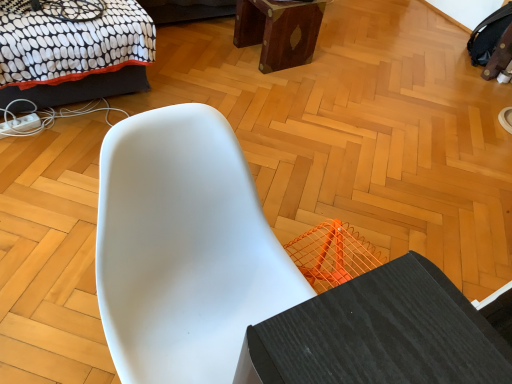
Question: Can you confirm if black dotted fabric bed at upper left is shorter than white matte chair at center?

Choices:
 (A) no
 (B) yes

Answer: (B)

Question: Can you confirm if black dotted fabric bed at upper left is positioned to the right of white matte chair at center?

Choices:
 (A) no
 (B) yes

Answer: (A)

Question: From a real-world perspective, is black dotted fabric bed at upper left below white matte chair at center?

Choices:
 (A) no
 (B) yes

Answer: (B)

Question: Considering the relative sizes of black dotted fabric bed at upper left and white matte chair at center in the image provided, is black dotted fabric bed at upper left bigger than white matte chair at center?

Choices:
 (A) no
 (B) yes

Answer: (A)

Question: Is black dotted fabric bed at upper left aimed at white matte chair at center?

Choices:
 (A) no
 (B) yes

Answer: (A)

Question: Considering the positions of point (49, 104) and point (266, 13), is point (49, 104) closer or farther from the camera than point (266, 13)?

Choices:
 (A) closer
 (B) farther

Answer: (A)

Question: In the image, is black dotted fabric bed at upper left on the left side or the right side of mahogany wood stool at upper center?

Choices:
 (A) left
 (B) right

Answer: (A)

Question: In terms of size, does black dotted fabric bed at upper left appear bigger or smaller than mahogany wood stool at upper center?

Choices:
 (A) big
 (B) small

Answer: (A)

Question: In the image, is black dotted fabric bed at upper left positioned in front of or behind mahogany wood stool at upper center?

Choices:
 (A) behind
 (B) front

Answer: (B)

Question: In terms of height, does mahogany wood stool at upper center look taller or shorter compared to white matte chair at center?

Choices:
 (A) tall
 (B) short

Answer: (B)

Question: From a real-world perspective, relative to white matte chair at center, is mahogany wood stool at upper center vertically above or below?

Choices:
 (A) above
 (B) below

Answer: (B)

Question: In the image, is mahogany wood stool at upper center on the left side or the right side of white matte chair at center?

Choices:
 (A) right
 (B) left

Answer: (A)

Question: Choose the correct answer: Is mahogany wood stool at upper center inside white matte chair at center or outside it?

Choices:
 (A) outside
 (B) inside

Answer: (A)

Question: Considering the positions of black dotted fabric bed at upper left and white matte chair at center in the image, is black dotted fabric bed at upper left taller or shorter than white matte chair at center?

Choices:
 (A) short
 (B) tall

Answer: (A)

Question: Is black dotted fabric bed at upper left inside or outside of white matte chair at center?

Choices:
 (A) inside
 (B) outside

Answer: (B)